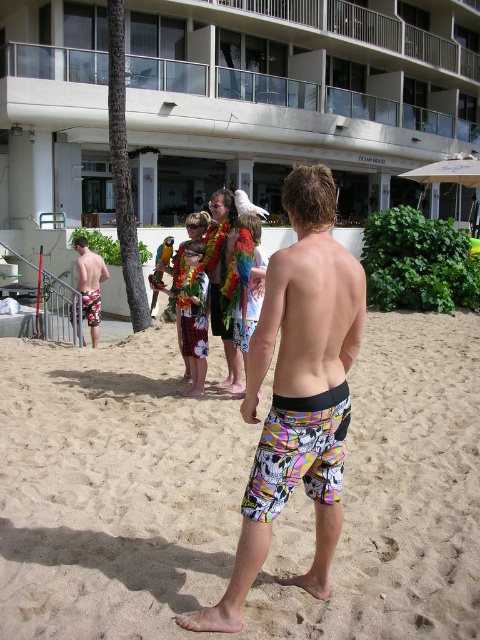
You are a photographer trying to capture the best angle of the two pairs of multicolored board shorts at center and multicolored board shorts at left. Since you want to emphasize their sizes in the photo, which one should you focus on to show a larger subject?

The multicolored board shorts at left should be focused on to show a larger subject because it has a greater width than the multicolored board shorts at center.

You are a photographer trying to capture the man in the multicolored printed shorts at center and the multicolored board shorts at center in the same frame. Which of the two should you focus on first if you want to include both in your shot?

The multicolored printed shorts at center is positioned on the left side of multicolored board shorts at center, so you should focus on the multicolored printed shorts at center first to ensure both are in frame.